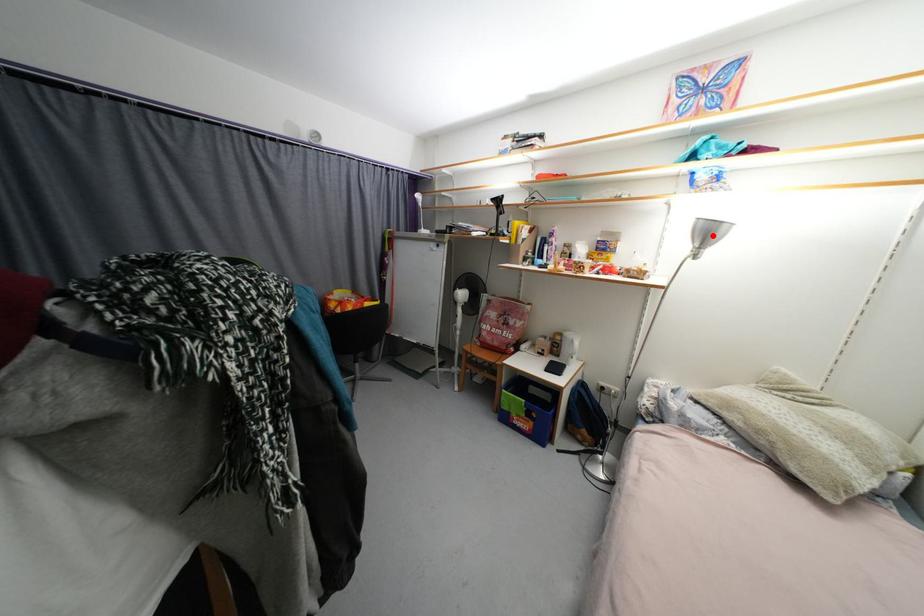
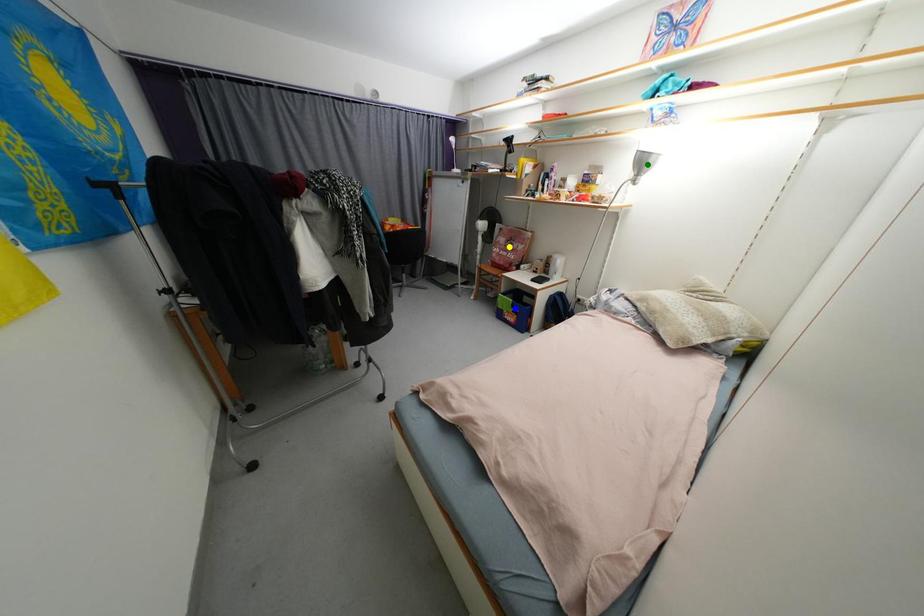
Question: I am providing you with two images of the same scene from different viewpoints. A red point is marked on the first image. You are given multiple points on the second image. Can you choose the point in image 2 that corresponds to the point in image 1?

Choices:
 (A) yellow point
 (B) green point
 (C) blue point

Answer: (B)